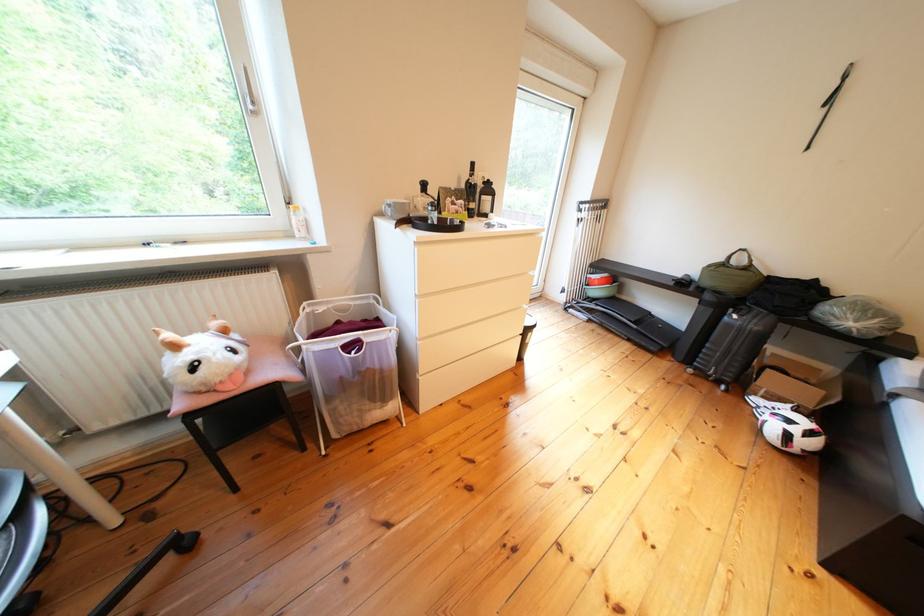
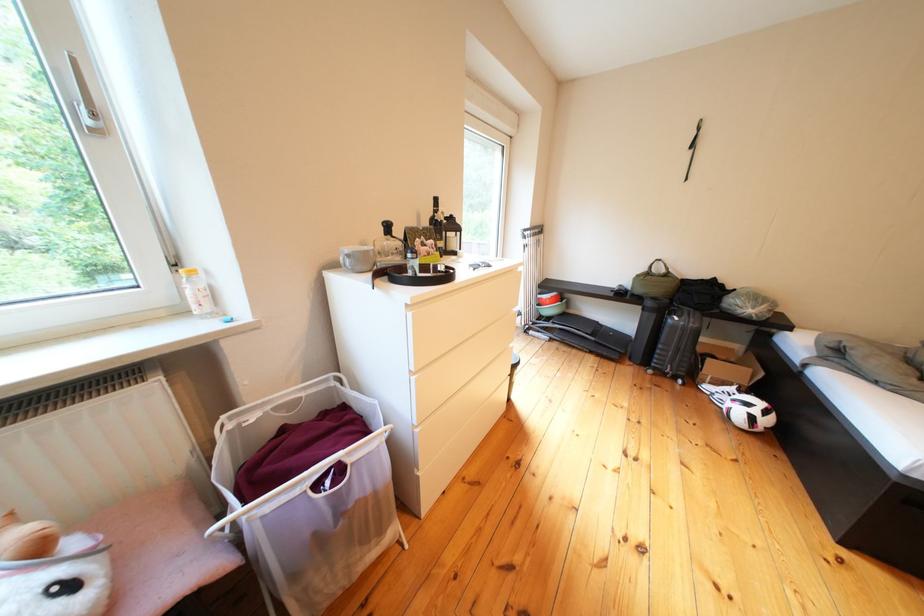
Question: How did the camera likely rotate?

Choices:
 (A) Left
 (B) Right
 (C) Up
 (D) Down

Answer: (B)